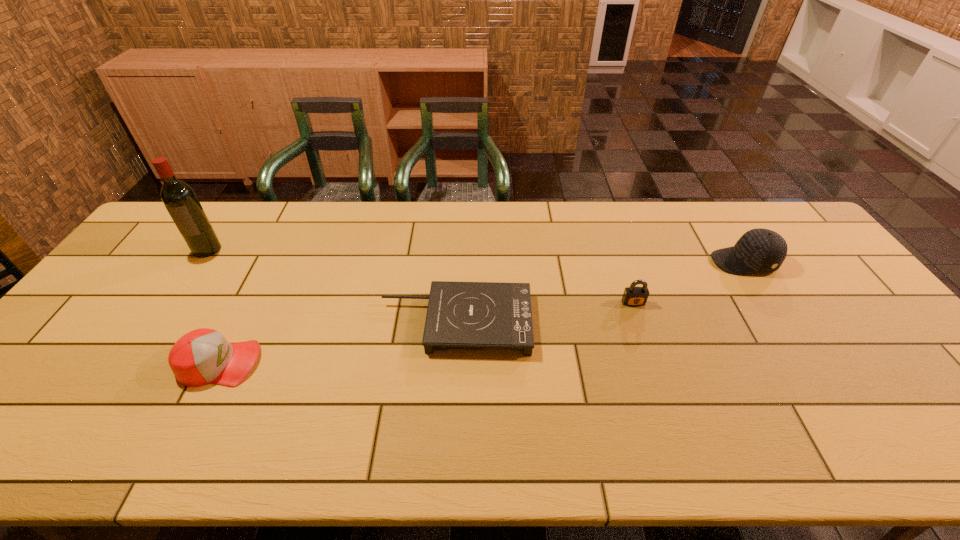
Identify which object is the fourth nearest to the farther baseball cap. Please provide its 2D coordinates. Your answer should be formatted as a tuple, i.e. [(x, y)], where the tuple contains the x and y coordinates of a point satisfying the conditions above.

[(181, 202)]

This screenshot has height=540, width=960. In order to click on object that is the fourth closest to the tallest object in this screenshot , I will do tap(759, 250).

I want to click on vacant space that satisfies the following two spatial constraints: 1. on the front side of the shortest object; 2. on the front-facing side of the nearer baseball cap, so point(453,363).

I want to click on vacant space that satisfies the following two spatial constraints: 1. at the front of the rightmost object where the brim is located; 2. on the front side of the hotplate, so click(782, 322).

Where is `vacant space that satisfies the following two spatial constraints: 1. on the front of the fourth object from left to right near the keyhole; 2. on the front-facing side of the nearer baseball cap`? vacant space that satisfies the following two spatial constraints: 1. on the front of the fourth object from left to right near the keyhole; 2. on the front-facing side of the nearer baseball cap is located at coordinates (654, 363).

Find the location of a particular element. free spot that satisfies the following two spatial constraints: 1. on the front of the second object from right to left near the keyhole; 2. on the front-facing side of the shorter baseball cap is located at coordinates (654, 363).